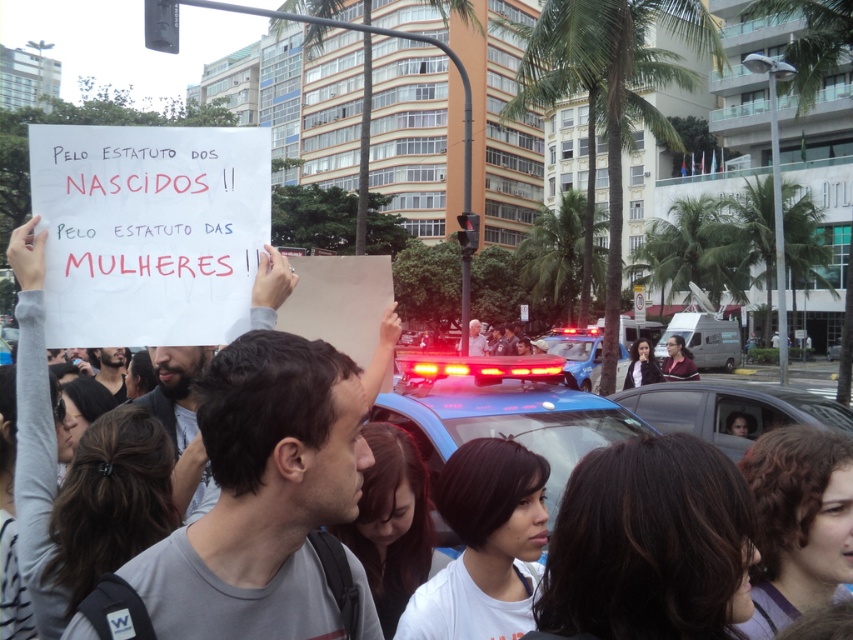
Which of these two, gray cotton shirt at center or black matte shirt at center, stands shorter?

With less height is black matte shirt at center.

Where is `gray cotton shirt at center`? gray cotton shirt at center is located at coordinates (263, 496).